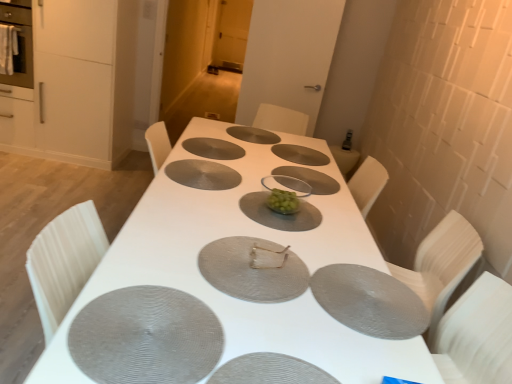
At what (x,y) coordinates should I click in order to perform the action: click on vacant area that lies between gray textured placemat at center, placed as the 7th pizza pan when sorted from back to front, and metallic silver pizza pan at center, positioned as the 5th pizza pan in back-to-front order. Please return your answer as a coordinate pair (x, y). This screenshot has height=384, width=512. Looking at the image, I should click on (206, 283).